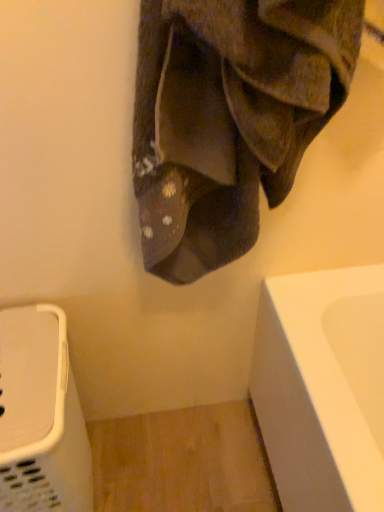
Question: From a real-world perspective, is brown suede shoes at upper center beneath white plastic laundry basket at lower left?

Choices:
 (A) no
 (B) yes

Answer: (A)

Question: From the image's perspective, does brown suede shoes at upper center appear lower than white plastic laundry basket at lower left?

Choices:
 (A) yes
 (B) no

Answer: (B)

Question: Is brown suede shoes at upper center positioned far away from white plastic laundry basket at lower left?

Choices:
 (A) no
 (B) yes

Answer: (A)

Question: Does brown suede shoes at upper center have a lesser width compared to white plastic laundry basket at lower left?

Choices:
 (A) yes
 (B) no

Answer: (A)

Question: From the image's perspective, is brown suede shoes at upper center on white plastic laundry basket at lower left?

Choices:
 (A) yes
 (B) no

Answer: (A)

Question: Considering the relative sizes of brown suede shoes at upper center and white plastic laundry basket at lower left in the image provided, is brown suede shoes at upper center wider than white plastic laundry basket at lower left?

Choices:
 (A) no
 (B) yes

Answer: (A)

Question: Is white plastic laundry basket at lower left completely or partially outside of brown suede shoes at upper center?

Choices:
 (A) yes
 (B) no

Answer: (A)

Question: Can you confirm if white plastic laundry basket at lower left is thinner than brown suede shoes at upper center?

Choices:
 (A) no
 (B) yes

Answer: (A)

Question: From a real-world perspective, is white plastic laundry basket at lower left below brown suede shoes at upper center?

Choices:
 (A) yes
 (B) no

Answer: (A)

Question: From the image's perspective, would you say white plastic laundry basket at lower left is shown under brown suede shoes at upper center?

Choices:
 (A) yes
 (B) no

Answer: (A)

Question: Considering the relative sizes of white plastic laundry basket at lower left and brown suede shoes at upper center in the image provided, is white plastic laundry basket at lower left bigger than brown suede shoes at upper center?

Choices:
 (A) yes
 (B) no

Answer: (A)

Question: Is white plastic laundry basket at lower left to the right of brown suede shoes at upper center from the viewer's perspective?

Choices:
 (A) no
 (B) yes

Answer: (A)

Question: Looking at their shapes, would you say brown suede shoes at upper center is wider or thinner than white plastic laundry basket at lower left?

Choices:
 (A) wide
 (B) thin

Answer: (B)